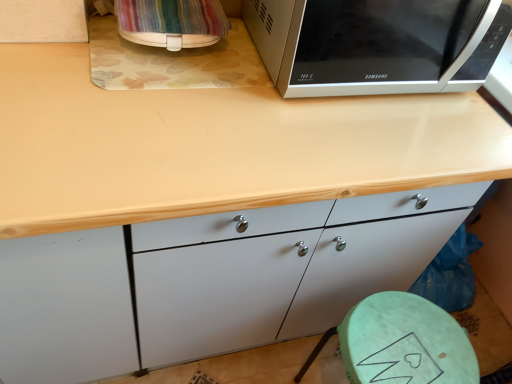
Question: Is sleek silver microwave at upper right taller or shorter than striped fabric bag at upper left?

Choices:
 (A) short
 (B) tall

Answer: (B)

Question: From a real-world perspective, is sleek silver microwave at upper right physically located above or below striped fabric bag at upper left?

Choices:
 (A) above
 (B) below

Answer: (A)

Question: Estimate the real-world distances between objects in this image. Which object is closer to the green matte stool at lower right?

Choices:
 (A) sleek silver microwave at upper right
 (B) wooden at upper center
 (C) striped fabric bag at upper left

Answer: (B)

Question: Estimate the real-world distances between objects in this image. Which object is farther from the sleek silver microwave at upper right?

Choices:
 (A) wooden at upper center
 (B) green matte stool at lower right
 (C) striped fabric bag at upper left

Answer: (B)